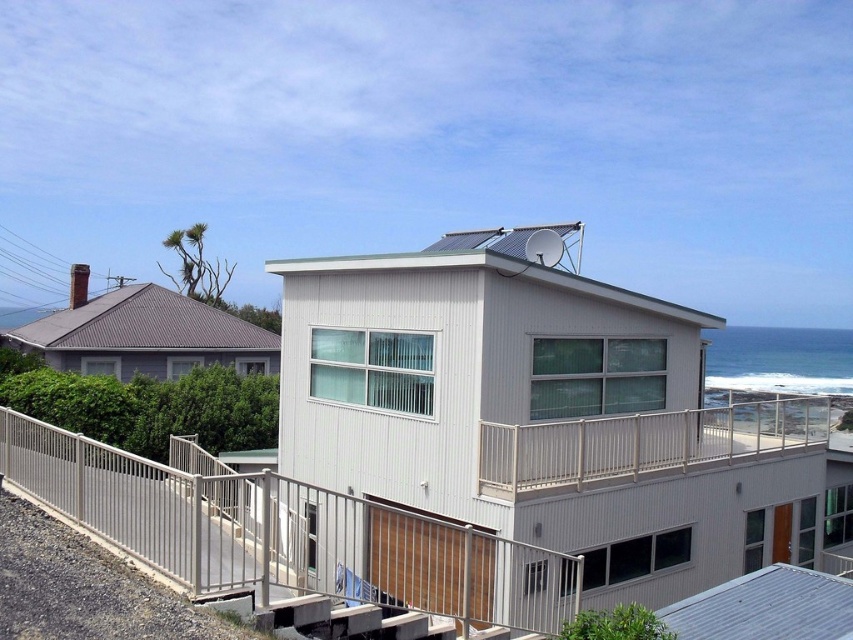
You are a visitor arriving at the house and want to compare the railings. Which railing is larger in size between the metallic silver railing at lower center and the satin silver railing at upper center?

The satin silver railing at upper center is larger than the metallic silver railing at lower center.

You are standing in front of the house and want to locate the railing closest to the ground. Which one is it between the metallic silver railing at lower center and the satin silver railing at upper center?

The metallic silver railing at lower center is closer to the ground since it is positioned to the left of the satin silver railing at upper center.